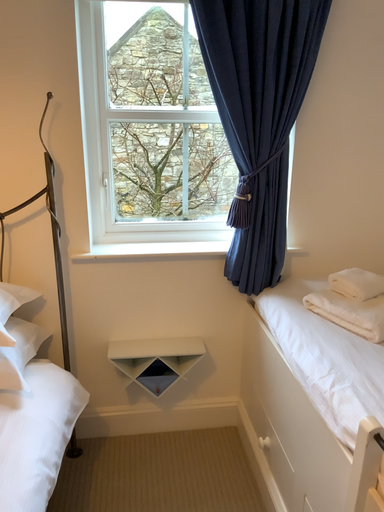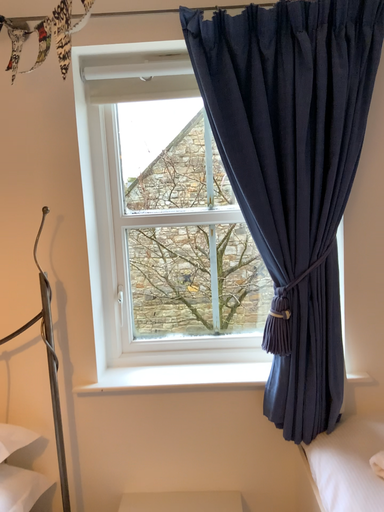
Question: How did the camera likely rotate when shooting the video?

Choices:
 (A) rotated left
 (B) rotated right

Answer: (A)